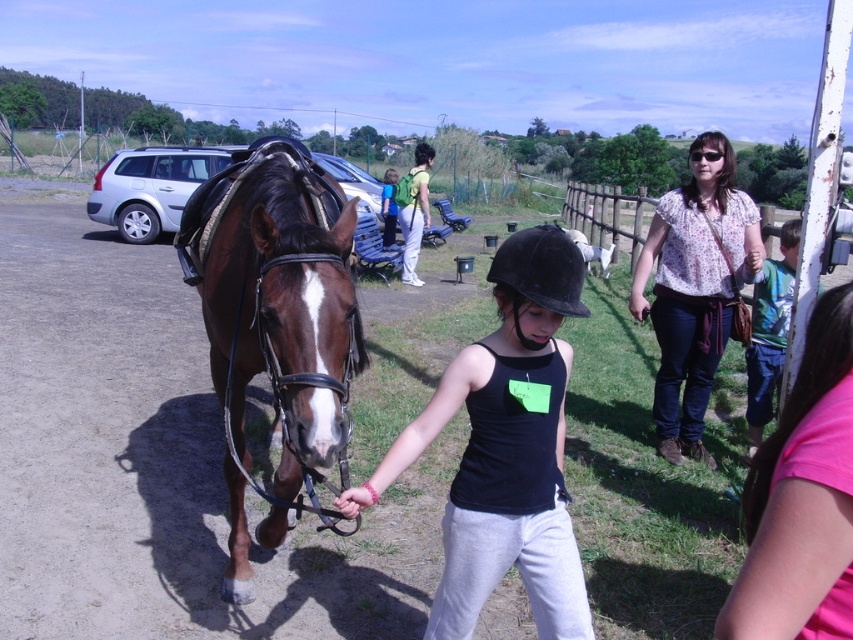
Between point (253, 346) and point (718, 189), which one is positioned in front?

Positioned in front is point (253, 346).

Between brown glossy horse at center and floral blouse at center, which one is positioned higher?

Positioned higher is floral blouse at center.

The image size is (853, 640). In order to click on brown glossy horse at center in this screenshot , I will do tap(276, 324).

Looking at this image, between black matte helmet at center and floral blouse at center, which one appears on the left side from the viewer's perspective?

black matte helmet at center

Is point (436, 401) closer to camera compared to point (640, 278)?

Yes, it is.

Which is behind, point (518, 404) or point (726, 212)?

The point (726, 212) is more distant.

You are a GUI agent. You are given a task and a screenshot of the screen. Output one action in this format:
    pyautogui.click(x=<x>, y=<y>)
    Task: Click on the black matte helmet at center
    The height and width of the screenshot is (640, 853).
    Given the screenshot: What is the action you would take?
    pyautogui.click(x=505, y=449)

Does brown glossy horse at center have a lesser width compared to black matte helmet at center?

Incorrect, brown glossy horse at center's width is not less than black matte helmet at center's.

This screenshot has width=853, height=640. What do you see at coordinates (276, 324) in the screenshot?
I see `brown glossy horse at center` at bounding box center [276, 324].

Identify the location of brown glossy horse at center. (276, 324).